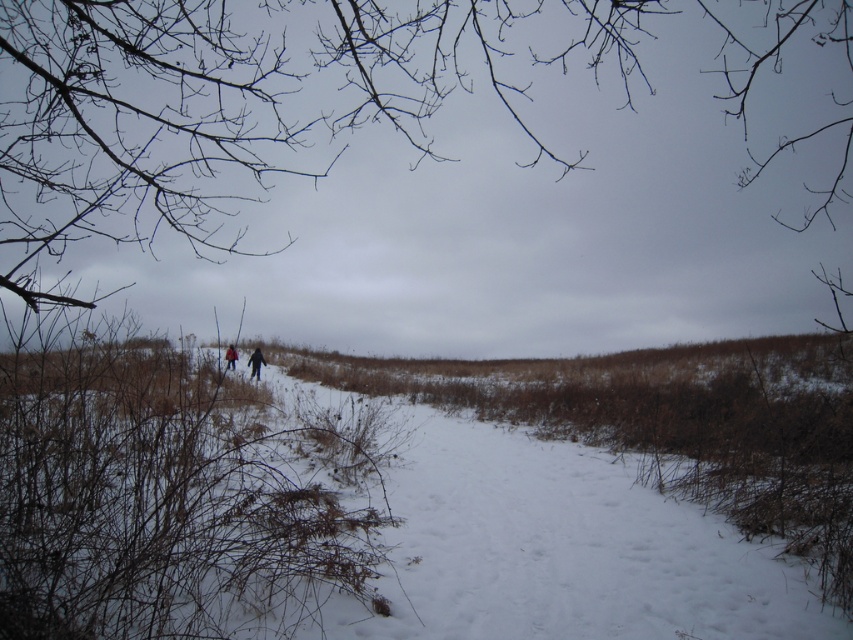
Question: Where is white powdery snow at center located in relation to dark blue jacket at center in the image?

Choices:
 (A) left
 (B) right

Answer: (B)

Question: Is white powdery snow at center to the left of snowy winter coat at center from the viewer's perspective?

Choices:
 (A) yes
 (B) no

Answer: (B)

Question: Which point is closer to the camera taking this photo?

Choices:
 (A) tap(252, 371)
 (B) tap(231, 352)

Answer: (B)

Question: Which of the following is the farthest from the observer?

Choices:
 (A) (248, 358)
 (B) (833, 636)

Answer: (A)

Question: Which of the following is the closest to the observer?

Choices:
 (A) white powdery snow at center
 (B) dark blue jacket at center
 (C) snowy winter coat at center

Answer: (A)

Question: Is white powdery snow at center thinner than snowy winter coat at center?

Choices:
 (A) no
 (B) yes

Answer: (A)